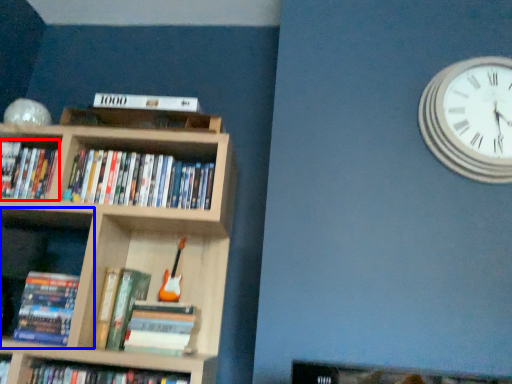
Question: Which of the following is the closest to the observer, book (highlighted by a red box) or shelf (highlighted by a blue box)?

Choices:
 (A) book
 (B) shelf

Answer: (B)